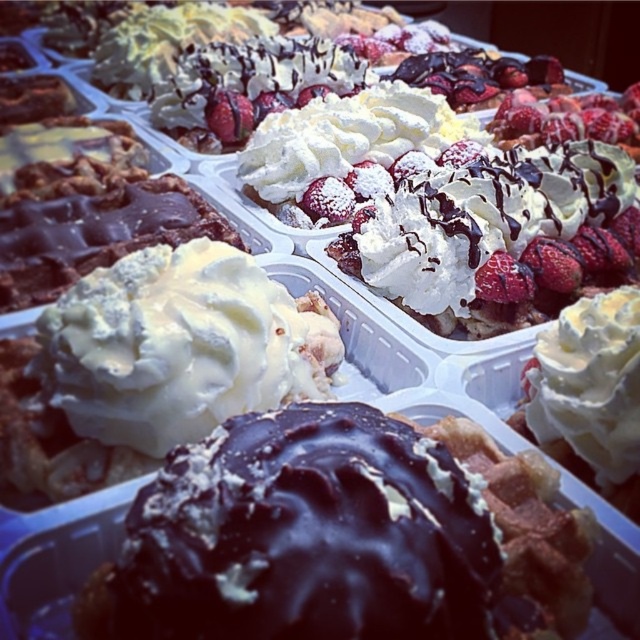
Question: Among these points, which one is farthest from the camera?

Choices:
 (A) (353, 60)
 (B) (348, 504)

Answer: (A)

Question: Is white fluffy waffle at center below white fluffy cream at center?

Choices:
 (A) no
 (B) yes

Answer: (B)

Question: Which of the following is the farthest from the observer?

Choices:
 (A) whipped cream at center
 (B) white fluffy cream at center
 (C) whipped cream topped waffle at center

Answer: (B)

Question: Can you confirm if whipped cream topped waffle at center is thinner than white fluffy waffle at center?

Choices:
 (A) no
 (B) yes

Answer: (A)

Question: Is chocolate glazed donut at center closer to camera compared to white fluffy waffle at center?

Choices:
 (A) yes
 (B) no

Answer: (A)

Question: Which of these objects is positioned closest to the whipped cream topped waffle at center?

Choices:
 (A) chocolate glazed donut at center
 (B) white fluffy waffle at center

Answer: (B)